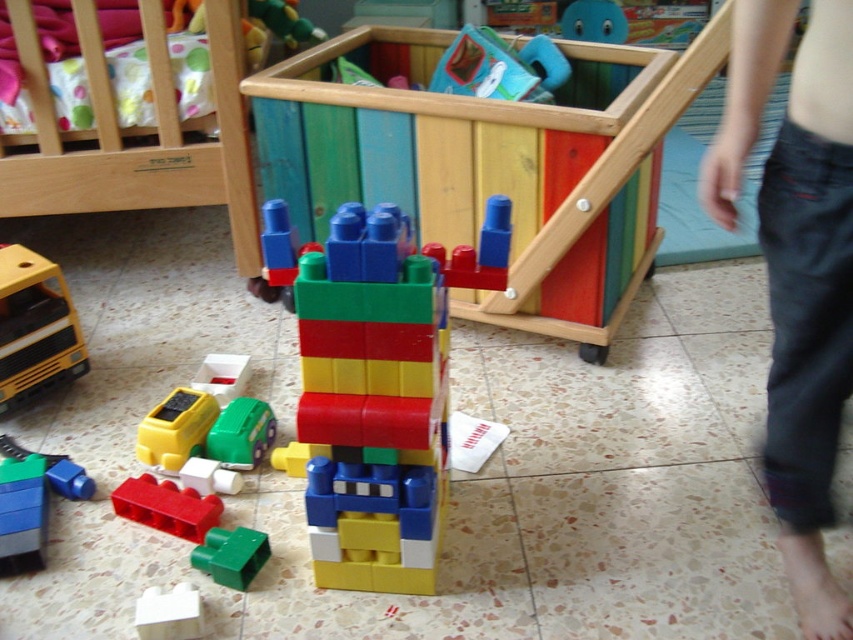
Is the position of brick-like plastic tower at center less distant than that of matte plastic blocks at lower left?

Yes, it is.

Can you confirm if brick-like plastic tower at center is bigger than matte plastic blocks at lower left?

Indeed, brick-like plastic tower at center has a larger size compared to matte plastic blocks at lower left.

Is point (294, 460) positioned before point (9, 556)?

No.

In order to click on brick-like plastic tower at center in this screenshot , I will do `click(375, 385)`.

Does wooden crib at lower left appear on the right side of smooth plastic car at lower left?

In fact, wooden crib at lower left is to the left of smooth plastic car at lower left.

Does wooden crib at lower left have a greater height compared to smooth plastic car at lower left?

Yes.

Does point (41, 108) come in front of point (244, 376)?

No, (41, 108) is behind (244, 376).

Locate an element on the screen. wooden crib at lower left is located at coordinates (136, 132).

Measure the distance from matte plastic blocks at lower left to green matte block at center.

11.21 inches

Can you confirm if matte plastic blocks at lower left is smaller than green matte block at center?

No, matte plastic blocks at lower left is not smaller than green matte block at center.

Where is `matte plastic blocks at lower left`? The image size is (853, 640). matte plastic blocks at lower left is located at coordinates (32, 500).